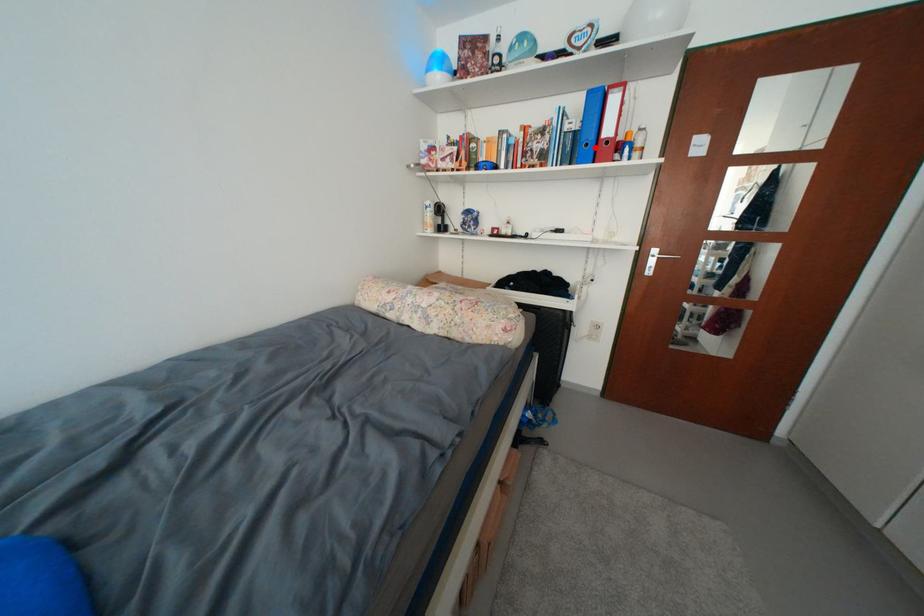
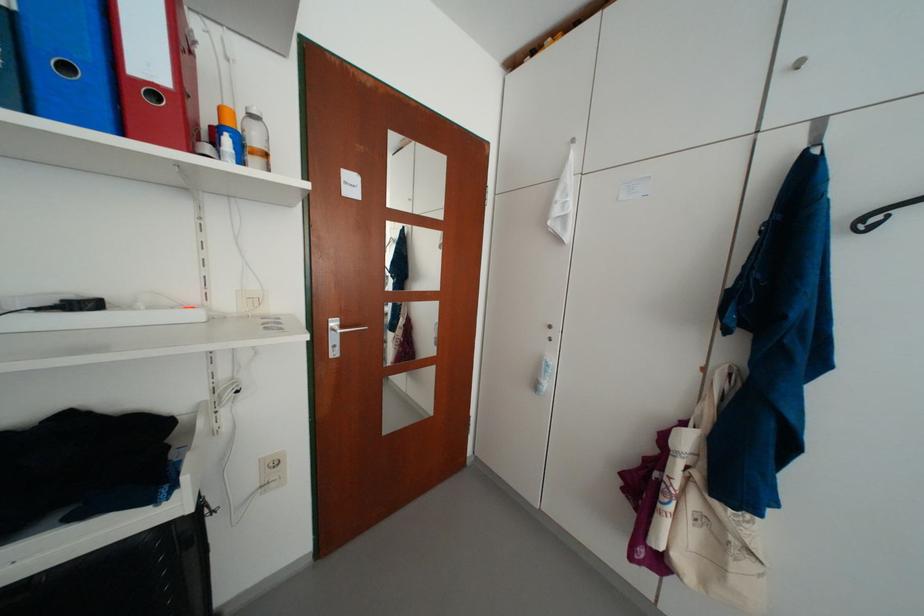
In the second image, find the point that corresponds to the highlighted location in the first image.

(76, 70)